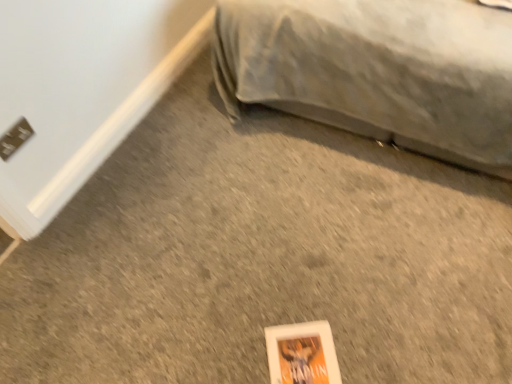
Locate an element on the screen. This screenshot has height=384, width=512. free space behind white matte paperback book at lower center is located at coordinates 288,294.